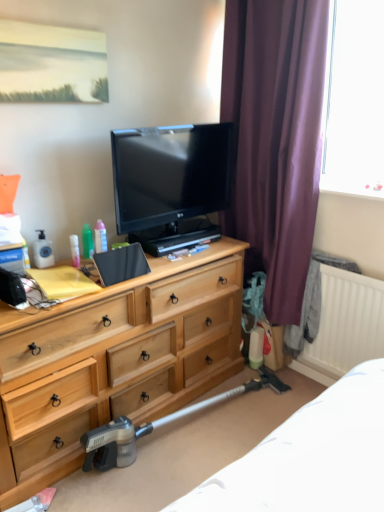
Question: Is matte black tv at center positioned far away from translucent plastic spray bottle at center-left, acting as the 1th toiletry starting from the right?

Choices:
 (A) no
 (B) yes

Answer: (A)

Question: Is matte black tv at center wider than translucent plastic spray bottle at center-left, the 3th toiletry when ordered from left to right?

Choices:
 (A) yes
 (B) no

Answer: (A)

Question: From a real-world perspective, is matte black tv at center positioned over translucent plastic spray bottle at center-left, acting as the 1th toiletry starting from the right, based on gravity?

Choices:
 (A) no
 (B) yes

Answer: (B)

Question: Considering the relative sizes of matte black tv at center and translucent plastic spray bottle at center-left, the 3th toiletry when ordered from left to right, in the image provided, is matte black tv at center smaller than translucent plastic spray bottle at center-left, the 3th toiletry when ordered from left to right,?

Choices:
 (A) no
 (B) yes

Answer: (A)

Question: Is matte black tv at center closer to camera compared to translucent plastic spray bottle at center-left, the 3th toiletry when ordered from left to right?

Choices:
 (A) no
 (B) yes

Answer: (B)

Question: From the image's perspective, is light wood dresser at center positioned above or below green plastic bottle at upper left, the second toiletry positioned from the left?

Choices:
 (A) below
 (B) above

Answer: (A)

Question: Is light wood dresser at center bigger or smaller than green plastic bottle at upper left, the second toiletry from the right?

Choices:
 (A) small
 (B) big

Answer: (B)

Question: Is point (173, 332) closer or farther from the camera than point (84, 249)?

Choices:
 (A) farther
 (B) closer

Answer: (A)

Question: In terms of height, does light wood dresser at center look taller or shorter compared to green plastic bottle at upper left, the second toiletry from the right?

Choices:
 (A) tall
 (B) short

Answer: (A)

Question: Is white matte radiator at lower right inside or outside of matte black tv at center?

Choices:
 (A) inside
 (B) outside

Answer: (B)

Question: Is point (324, 288) positioned closer to the camera than point (153, 245)?

Choices:
 (A) farther
 (B) closer

Answer: (A)

Question: Considering the positions of white matte radiator at lower right and matte black tv at center in the image, is white matte radiator at lower right taller or shorter than matte black tv at center?

Choices:
 (A) short
 (B) tall

Answer: (B)

Question: From a real-world perspective, relative to matte black tv at center, is white matte radiator at lower right vertically above or below?

Choices:
 (A) below
 (B) above

Answer: (A)

Question: Do you think purple velvet curtain at right is within metallic gray vacuum cleaner at lower center, or outside of it?

Choices:
 (A) inside
 (B) outside

Answer: (B)

Question: From a real-world perspective, is purple velvet curtain at right physically located above or below metallic gray vacuum cleaner at lower center?

Choices:
 (A) above
 (B) below

Answer: (A)